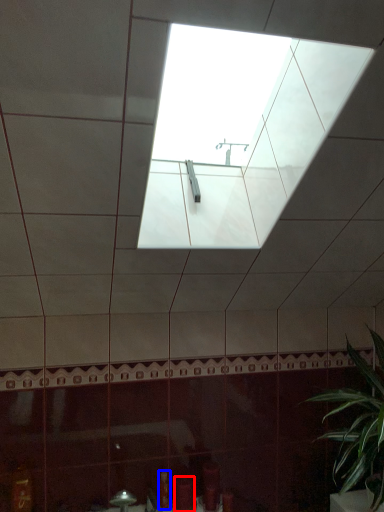
Question: Which object appears farthest to the camera in this image, toiletry (highlighted by a red box) or toiletry (highlighted by a blue box)?

Choices:
 (A) toiletry
 (B) toiletry

Answer: (B)